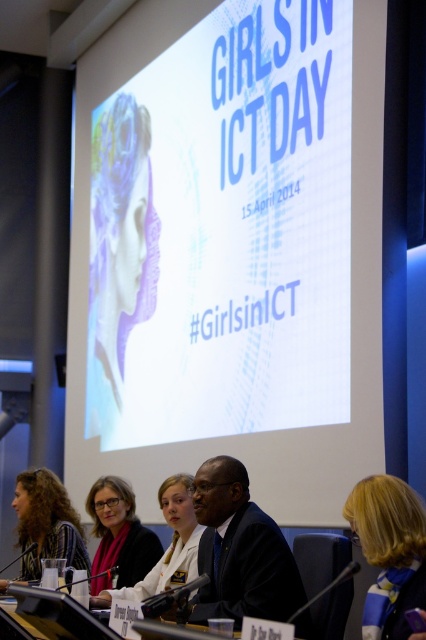
Does point (253, 586) lie behind point (37, 548)?

No.

Does dark blue suit at center have a larger size compared to curly hair at lower left?

No, dark blue suit at center is not bigger than curly hair at lower left.

Where is `dark blue suit at center`? The width and height of the screenshot is (426, 640). dark blue suit at center is located at coordinates (239, 550).

Is point (201, 616) less distant than point (362, 525)?

No, it is not.

Between point (219, 481) and point (394, 621), which one is positioned in front?

Positioned in front is point (394, 621).

Identify the location of dark blue suit at center. (239, 550).

Is white matte projection screen at upper center to the left of matte black jacket at lower left from the viewer's perspective?

Incorrect, white matte projection screen at upper center is not on the left side of matte black jacket at lower left.

What do you see at coordinates (230, 250) in the screenshot?
I see `white matte projection screen at upper center` at bounding box center [230, 250].

Between point (339, 150) and point (94, 502), which one is positioned behind?

Positioned behind is point (94, 502).

The height and width of the screenshot is (640, 426). Identify the location of white matte projection screen at upper center. (230, 250).